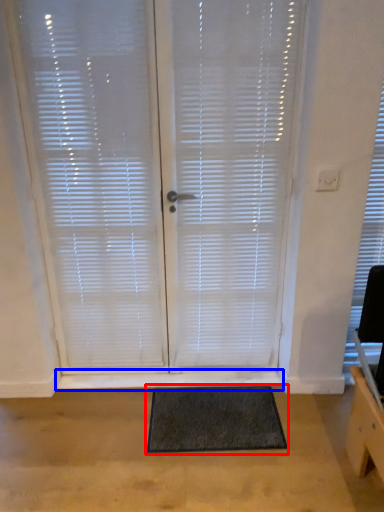
Question: Which of the following is the farthest to the observer, doormat (highlighted by a red box) or window sill (highlighted by a blue box)?

Choices:
 (A) doormat
 (B) window sill

Answer: (B)